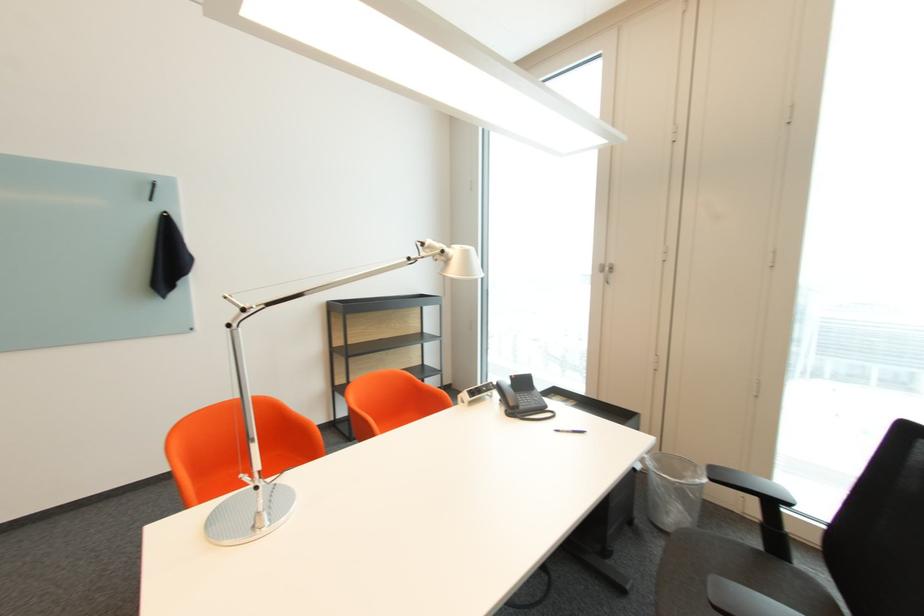
Locate an element on the screen. black chair armrest is located at coordinates (748, 484).